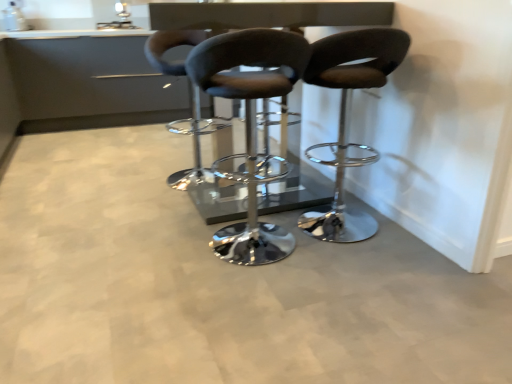
Question: Is matte silver sink at upper center with glossy black table at center?

Choices:
 (A) no
 (B) yes

Answer: (A)

Question: Is matte silver sink at upper center looking in the opposite direction of glossy black table at center?

Choices:
 (A) no
 (B) yes

Answer: (A)

Question: From a real-world perspective, is matte silver sink at upper center positioned over glossy black table at center based on gravity?

Choices:
 (A) yes
 (B) no

Answer: (A)

Question: From the image's perspective, is matte silver sink at upper center located beneath glossy black table at center?

Choices:
 (A) no
 (B) yes

Answer: (A)

Question: From a real-world perspective, is matte silver sink at upper center physically below glossy black table at center?

Choices:
 (A) no
 (B) yes

Answer: (A)

Question: Is matte silver sink at upper center further to the viewer compared to glossy black table at center?

Choices:
 (A) yes
 (B) no

Answer: (A)

Question: From the image's perspective, is glossy black table at center on matte black stool at center, which is counted as the second chair, starting from the left?

Choices:
 (A) no
 (B) yes

Answer: (B)

Question: From a real-world perspective, is glossy black table at center positioned over matte black stool at center, the second chair viewed from the right, based on gravity?

Choices:
 (A) no
 (B) yes

Answer: (B)

Question: Considering the relative sizes of glossy black table at center and matte black stool at center, the second chair viewed from the right, in the image provided, is glossy black table at center bigger than matte black stool at center, the second chair viewed from the right,?

Choices:
 (A) yes
 (B) no

Answer: (A)

Question: Are glossy black table at center and matte black stool at center, which is counted as the second chair, starting from the left, making contact?

Choices:
 (A) yes
 (B) no

Answer: (B)

Question: Is glossy black table at center oriented towards matte black stool at center, the second chair viewed from the right?

Choices:
 (A) yes
 (B) no

Answer: (B)

Question: Is glossy black table at center positioned behind matte black stool at center, the second chair viewed from the right?

Choices:
 (A) no
 (B) yes

Answer: (B)

Question: Is matte black stool at center, the second chair viewed from the right, next to matte black stool at center, placed as the 1th chair when sorted from right to left?

Choices:
 (A) no
 (B) yes

Answer: (A)